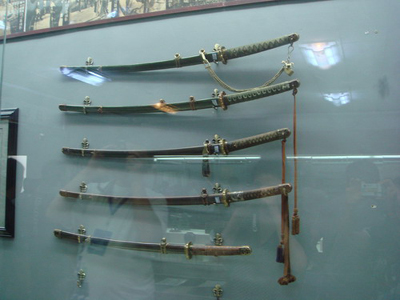
Image resolution: width=400 pixels, height=300 pixels. Identify the location of handle. (225, 249).